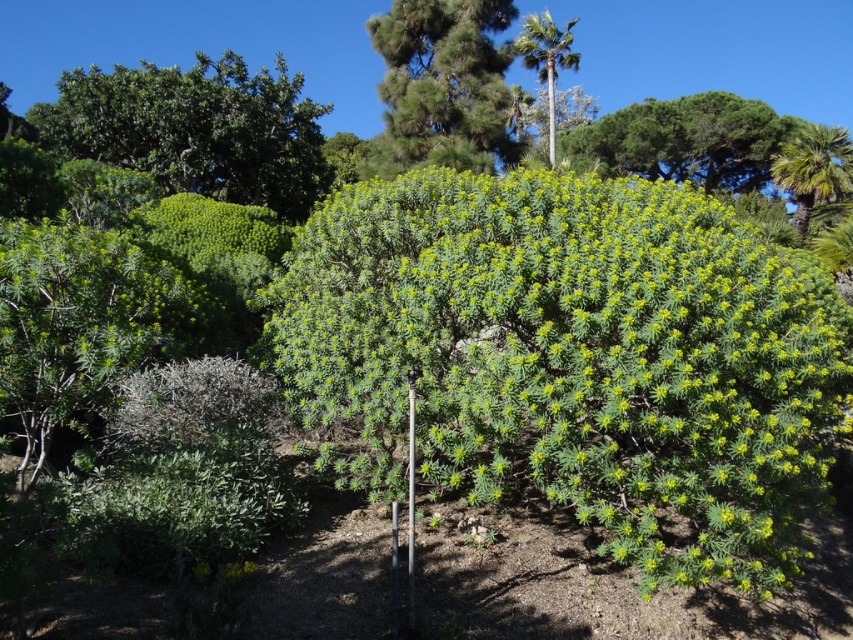
Is point (756, 522) in front of point (285, 72)?

Yes, it is.

What do you see at coordinates (573, 358) in the screenshot? Image resolution: width=853 pixels, height=640 pixels. I see `green leafy bush at center` at bounding box center [573, 358].

Where is `green leafy bush at center`? green leafy bush at center is located at coordinates coord(573,358).

This screenshot has width=853, height=640. Describe the element at coordinates (573, 358) in the screenshot. I see `green leafy bush at center` at that location.

Who is lower down, green leafy bush at center or green leafy bush at upper center?

green leafy bush at center

Is point (701, 452) more distant than point (561, 132)?

No, it is in front of (561, 132).

At what (x,y) coordinates should I click in order to perform the action: click on green leafy bush at center. Please return your answer as a coordinate pair (x, y). This screenshot has height=640, width=853. Looking at the image, I should click on (573, 358).

Is green leafy bush at center to the left of green leafy palm at right from the viewer's perspective?

Indeed, green leafy bush at center is positioned on the left side of green leafy palm at right.

Between green leafy bush at center and green leafy palm at right, which one has more height?

green leafy bush at center

Between point (747, 464) and point (815, 182), which one is positioned behind?

The point (815, 182) is behind.

Locate an element on the screen. The width and height of the screenshot is (853, 640). green leafy bush at center is located at coordinates (573, 358).